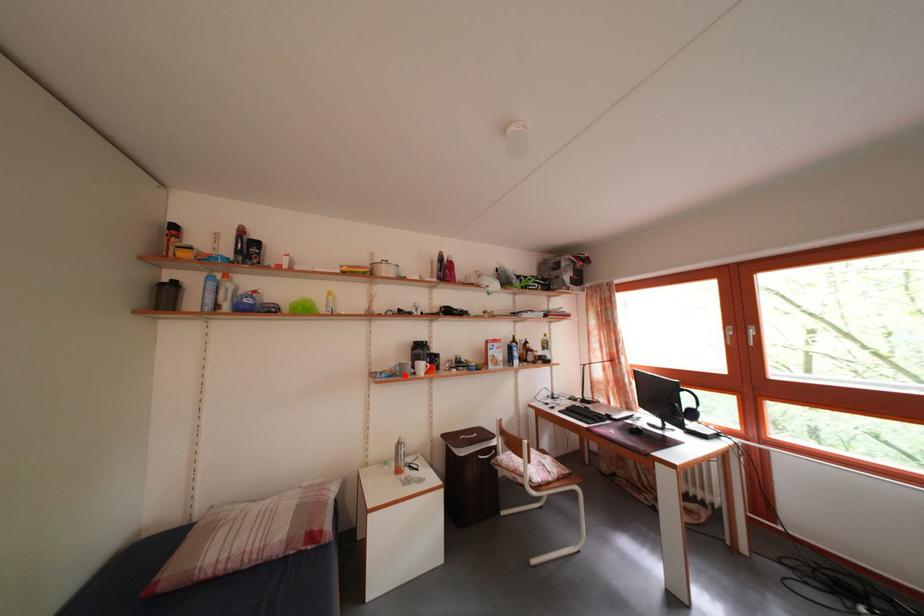
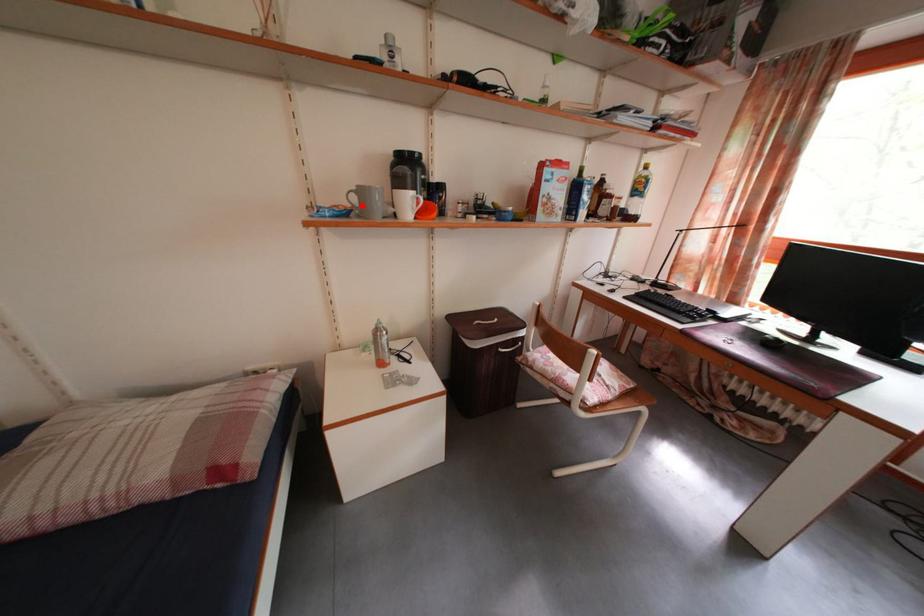
I am providing you with two images of the same scene from different viewpoints. A red point is marked on the first image and another point is marked on the second image. Is the red point in image1 aligned with the point shown in image2?

Yes